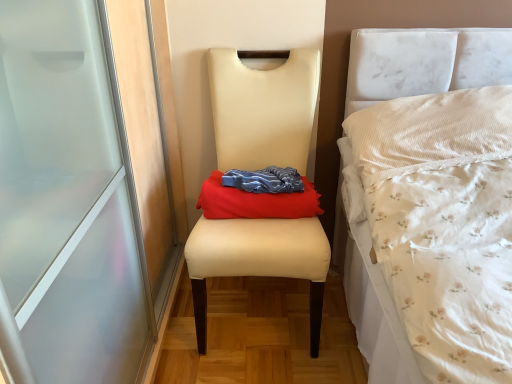
The image size is (512, 384). What do you see at coordinates (263, 110) in the screenshot?
I see `matte cream chair at center` at bounding box center [263, 110].

Image resolution: width=512 pixels, height=384 pixels. In order to click on matte cream chair at center in this screenshot , I will do `click(263, 110)`.

The width and height of the screenshot is (512, 384). Describe the element at coordinates (259, 194) in the screenshot. I see `red fabric cloth at center` at that location.

Identify the location of red fabric cloth at center. (259, 194).

At what (x,y) coordinates should I click in order to perform the action: click on matte cream chair at center. Please return your answer as a coordinate pair (x, y). Looking at the image, I should click on (263, 110).

Based on their positions, is red fabric cloth at center located to the left or right of matte cream chair at center?

From the image, it's evident that red fabric cloth at center is to the right of matte cream chair at center.

Is red fabric cloth at center positioned before matte cream chair at center?

No, it is not.

Considering the points (286, 199) and (319, 282), which point is in front, point (286, 199) or point (319, 282)?

The point (319, 282) is in front.

In the scene shown: From the image's perspective, which object appears higher, red fabric cloth at center or matte cream chair at center?

From the image's view, red fabric cloth at center is above.

From a real-world perspective, is red fabric cloth at center physically located above or below matte cream chair at center?

In terms of real-world spatial position, red fabric cloth at center is above matte cream chair at center.

Is red fabric cloth at center thinner than matte cream chair at center?

Correct, the width of red fabric cloth at center is less than that of matte cream chair at center.

Who is shorter, red fabric cloth at center or matte cream chair at center?

Standing shorter between the two is red fabric cloth at center.

Which of these two, red fabric cloth at center or matte cream chair at center, is smaller?

Smaller between the two is red fabric cloth at center.

Would you say red fabric cloth at center is inside or outside matte cream chair at center?

red fabric cloth at center is contained in matte cream chair at center.

Are red fabric cloth at center and matte cream chair at center beside each other?

They are not placed beside each other.

Is red fabric cloth at center positioned with its back to matte cream chair at center?

Correct, red fabric cloth at center is looking away from matte cream chair at center.

Where is `material on the right of matte cream chair at center`? This screenshot has width=512, height=384. material on the right of matte cream chair at center is located at coordinates (259, 194).

Based on their positions, is matte cream chair at center located to the left or right of red fabric cloth at center?

matte cream chair at center is to the left of red fabric cloth at center.

Does matte cream chair at center lie behind red fabric cloth at center?

That is False.

Which point is more forward, [240,251] or [217,178]?

Positioned in front is point [240,251].

From the image's perspective, would you say matte cream chair at center is shown under red fabric cloth at center?

Indeed, from the image's perspective, matte cream chair at center is shown beneath red fabric cloth at center.

From a real-world perspective, is matte cream chair at center over red fabric cloth at center?

No, from a real-world perspective, matte cream chair at center is not over red fabric cloth at center

Considering the sizes of matte cream chair at center and red fabric cloth at center in the image, is matte cream chair at center wider or thinner than red fabric cloth at center?

Considering their sizes, matte cream chair at center looks broader than red fabric cloth at center.

Which of these two, matte cream chair at center or red fabric cloth at center, stands shorter?

Standing shorter between the two is red fabric cloth at center.

Is matte cream chair at center bigger than red fabric cloth at center?

Yes, matte cream chair at center is bigger than red fabric cloth at center.

Choose the correct answer: Is matte cream chair at center inside red fabric cloth at center or outside it?

matte cream chair at center exists outside the volume of red fabric cloth at center.

Can you see matte cream chair at center touching red fabric cloth at center?

No.

Is matte cream chair at center facing towards red fabric cloth at center?

Yes, matte cream chair at center faces towards red fabric cloth at center.

The height and width of the screenshot is (384, 512). I want to click on chair on the left of red fabric cloth at center, so click(263, 110).

Find the location of a particular element. This screenshot has width=512, height=384. material above the matte cream chair at center (from the image's perspective) is located at coordinates (259, 194).

Where is `material above the matte cream chair at center (from a real-world perspective)`? This screenshot has width=512, height=384. material above the matte cream chair at center (from a real-world perspective) is located at coordinates (259, 194).